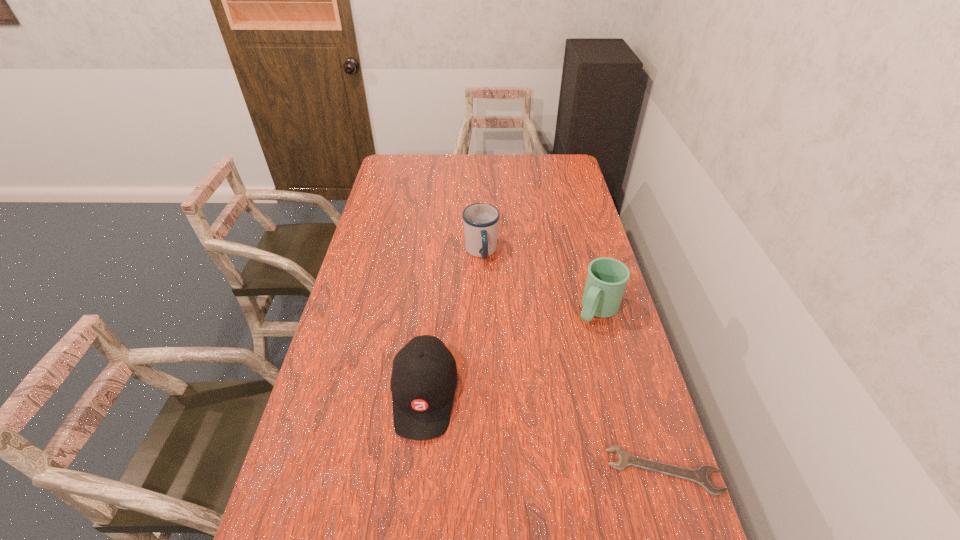
Where is `baseball cap`? This screenshot has width=960, height=540. baseball cap is located at coordinates (423, 382).

Locate an element on the screen. The height and width of the screenshot is (540, 960). the nearest object is located at coordinates (701, 476).

The height and width of the screenshot is (540, 960). What are the coordinates of `wrench` in the screenshot? It's located at (701, 476).

Locate an element on the screen. This screenshot has width=960, height=540. the farther mug is located at coordinates (481, 220).

You are a GUI agent. You are given a task and a screenshot of the screen. Output one action in this format:
    pyautogui.click(x=<x>, y=<y>)
    Task: Click on the left mug
    Image resolution: width=960 pixels, height=540 pixels.
    Given the screenshot: What is the action you would take?
    pyautogui.click(x=481, y=220)

The width and height of the screenshot is (960, 540). In order to click on the third nearest object in this screenshot , I will do `click(606, 280)`.

Identify the location of the right mug. (606, 280).

This screenshot has width=960, height=540. Find the location of `vacant space located with a logo on the front of the baseball cap`. vacant space located with a logo on the front of the baseball cap is located at coordinates 414,491.

Where is `free location located on the left of the wrench`? The height and width of the screenshot is (540, 960). free location located on the left of the wrench is located at coordinates (511, 470).

Find the location of a particular element. vacant area located 0.170m on the handle side of the left mug is located at coordinates (495, 301).